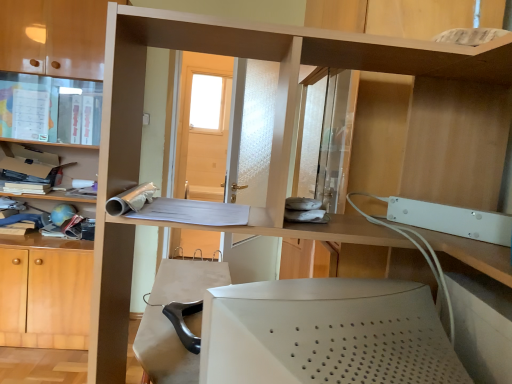
Question: Does matte plastic shelf at left, which is the first shelf in left-to-right order, appear on the right side of white matte desktop computer at lower center?

Choices:
 (A) no
 (B) yes

Answer: (A)

Question: Is white matte desktop computer at lower center at the back of matte plastic shelf at left, the 1th shelf positioned from the back?

Choices:
 (A) no
 (B) yes

Answer: (A)

Question: Considering the relative sizes of matte plastic shelf at left, the 1th shelf positioned from the back, and white matte desktop computer at lower center in the image provided, is matte plastic shelf at left, the 1th shelf positioned from the back, bigger than white matte desktop computer at lower center?

Choices:
 (A) yes
 (B) no

Answer: (B)

Question: Is matte plastic shelf at left, marked as the second shelf in a front-to-back arrangement, to the left of white matte desktop computer at lower center from the viewer's perspective?

Choices:
 (A) yes
 (B) no

Answer: (A)

Question: Does matte plastic shelf at left, which is counted as the 2th shelf, starting from the right, turn towards white matte desktop computer at lower center?

Choices:
 (A) yes
 (B) no

Answer: (A)

Question: Considering the positions of wooden shelf at upper right, which ranks as the first shelf in front-to-back order, and white matte desktop computer at lower center in the image, is wooden shelf at upper right, which ranks as the first shelf in front-to-back order, bigger or smaller than white matte desktop computer at lower center?

Choices:
 (A) small
 (B) big

Answer: (A)

Question: From the image's perspective, is wooden shelf at upper right, which ranks as the first shelf in front-to-back order, above or below white matte desktop computer at lower center?

Choices:
 (A) above
 (B) below

Answer: (A)

Question: Considering the relative positions of wooden shelf at upper right, which appears as the first shelf when viewed from the right, and white matte desktop computer at lower center in the image provided, is wooden shelf at upper right, which appears as the first shelf when viewed from the right, to the left or to the right of white matte desktop computer at lower center?

Choices:
 (A) left
 (B) right

Answer: (B)

Question: Is wooden shelf at upper right, which ranks as the first shelf in front-to-back order, situated inside white matte desktop computer at lower center or outside?

Choices:
 (A) inside
 (B) outside

Answer: (B)

Question: Do you think wooden shelf at upper right, which appears as the first shelf when viewed from the right, is within matte plastic cabinet at upper left, or outside of it?

Choices:
 (A) outside
 (B) inside

Answer: (A)

Question: From a real-world perspective, is wooden shelf at upper right, which ranks as the first shelf in front-to-back order, above or below matte plastic cabinet at upper left?

Choices:
 (A) above
 (B) below

Answer: (A)

Question: Is wooden shelf at upper right, which ranks as the first shelf in front-to-back order, wider or thinner than matte plastic cabinet at upper left?

Choices:
 (A) thin
 (B) wide

Answer: (A)

Question: Based on their sizes in the image, would you say wooden shelf at upper right, which ranks as the first shelf in front-to-back order, is bigger or smaller than matte plastic cabinet at upper left?

Choices:
 (A) small
 (B) big

Answer: (A)

Question: In the image, is matte plastic shelf at left, which is the first shelf in left-to-right order, on the left side or the right side of white matte desktop computer at lower center?

Choices:
 (A) left
 (B) right

Answer: (A)

Question: Choose the correct answer: Is matte plastic shelf at left, the 1th shelf positioned from the back, inside white matte desktop computer at lower center or outside it?

Choices:
 (A) inside
 (B) outside

Answer: (B)